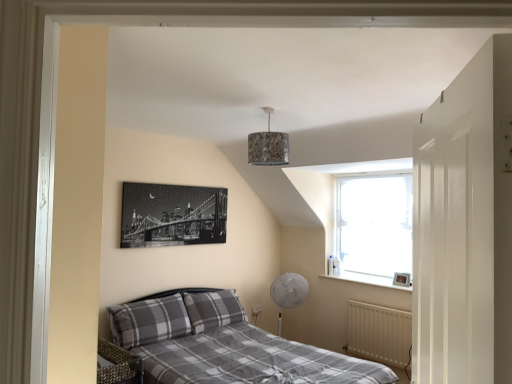
Locate an element on the screen. free point above camouflage fabric lampshade at center (from a real-world perspective) is located at coordinates (273, 108).